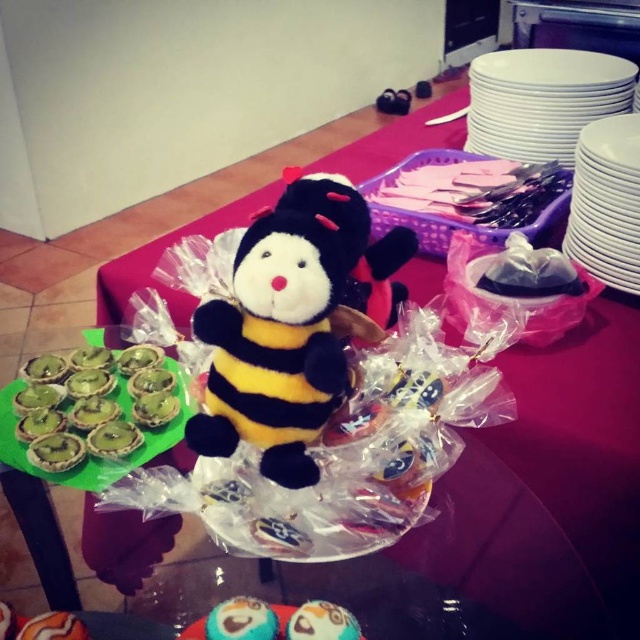
Question: Considering the real-world distances, which object is closest to the white glossy plate at upper right?

Choices:
 (A) soft plush bee at center
 (B) smooth glossy cake at center
 (C) smooth chocolate cupcake at center

Answer: (A)

Question: Which point appears farthest from the camera in this image?

Choices:
 (A) (612, 173)
 (B) (83, 477)
 (C) (54, 611)

Answer: (A)

Question: Does green matte tartlets at center appear under white glossy plate at upper right?

Choices:
 (A) yes
 (B) no

Answer: (A)

Question: Is the position of soft plush bee at center more distant than that of white glossy plate at upper right?

Choices:
 (A) no
 (B) yes

Answer: (A)

Question: Which of these objects is positioned farthest from the white glossy plates at upper right?

Choices:
 (A) blue matte plush toy at center
 (B) soft plush bee at center

Answer: (A)

Question: Can you confirm if soft plush bee at center is positioned above white glossy plates at upper right?

Choices:
 (A) no
 (B) yes

Answer: (A)